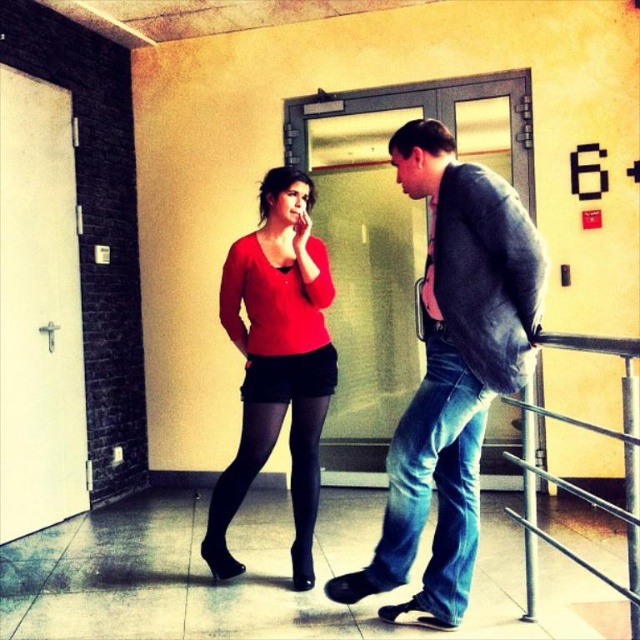
Between matte red sweater at center and metallic silver railing at lower right, which one appears on the right side from the viewer's perspective?

metallic silver railing at lower right is more to the right.

Between point (314, 456) and point (632, 448), which one is positioned behind?

The point (314, 456) is more distant.

This screenshot has height=640, width=640. What do you see at coordinates (276, 362) in the screenshot?
I see `matte red sweater at center` at bounding box center [276, 362].

Identify the location of matte red sweater at center. (276, 362).

Between denim jeans at center and matte red sweater at center, which one is positioned lower?

matte red sweater at center is lower down.

Who is positioned more to the right, denim jeans at center or matte red sweater at center?

denim jeans at center

Is point (477, 260) less distant than point (307, 208)?

Yes, point (477, 260) is in front of point (307, 208).

At what (x,y) coordinates should I click in order to perform the action: click on denim jeans at center. Please return your answer as a coordinate pair (x, y). This screenshot has height=640, width=640. Looking at the image, I should click on (452, 371).

Is point (440, 410) farther from viewer compared to point (524, 522)?

That is False.

Locate an element on the screen. Image resolution: width=640 pixels, height=640 pixels. denim jeans at center is located at coordinates (452, 371).